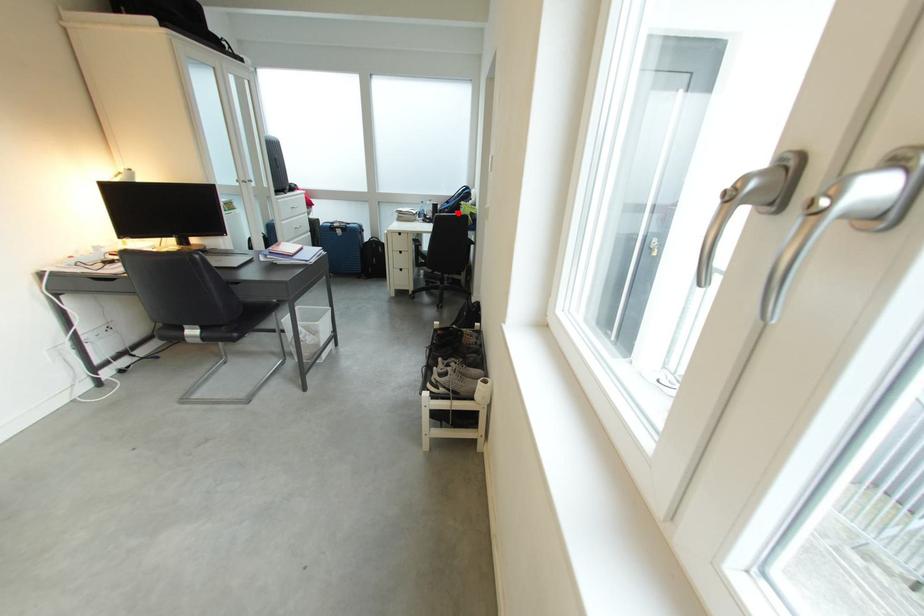
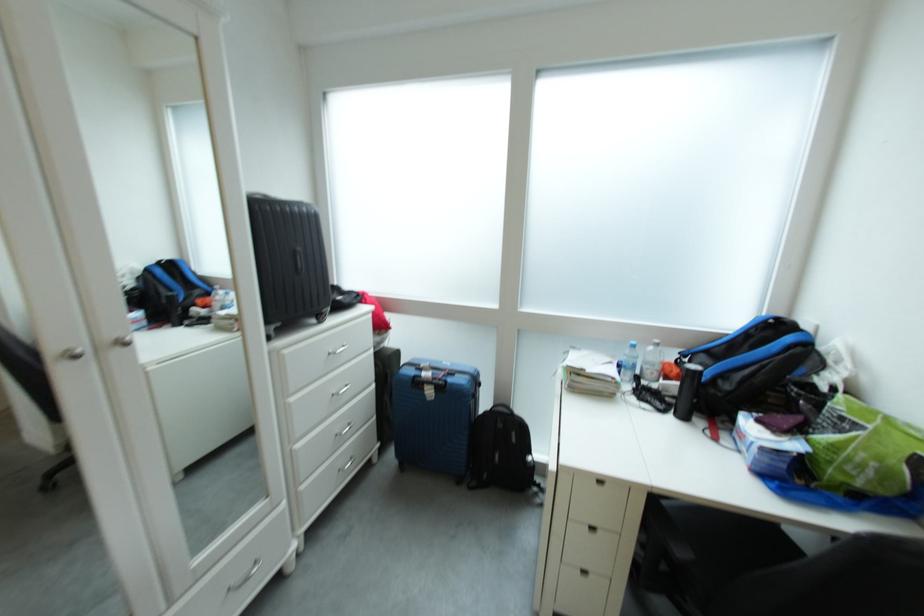
Locate, in the second image, the point that corresponds to the highlighted location in the first image.

(737, 390)